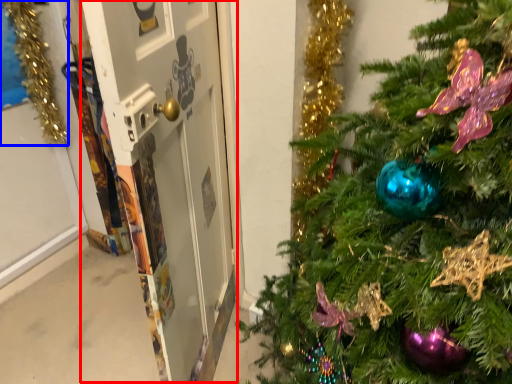
Question: Which object appears farthest to the camera in this image, screen door (highlighted by a red box) or christmas decoration (highlighted by a blue box)?

Choices:
 (A) screen door
 (B) christmas decoration

Answer: (B)